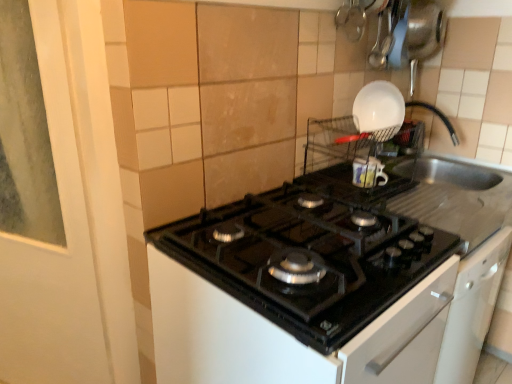
The width and height of the screenshot is (512, 384). Describe the element at coordinates (379, 110) in the screenshot. I see `white glossy bowl at upper right` at that location.

The image size is (512, 384). Identify the location of white glossy bowl at upper right. (379, 110).

Measure the distance between black glass gas stove at center and camera.

black glass gas stove at center is 28.72 inches away from camera.

Where is `black glass gas stove at center`? This screenshot has width=512, height=384. black glass gas stove at center is located at coordinates 308,257.

The height and width of the screenshot is (384, 512). What do you see at coordinates (308, 257) in the screenshot? I see `black glass gas stove at center` at bounding box center [308, 257].

This screenshot has height=384, width=512. Find the location of `white glossy bowl at upper right`. white glossy bowl at upper right is located at coordinates (379, 110).

Which object is positioned more to the left, white glossy bowl at upper right or black glass gas stove at center?

Positioned to the left is black glass gas stove at center.

Does white glossy bowl at upper right lie behind black glass gas stove at center?

Yes.

Does point (371, 108) appear closer or farther from the camera than point (320, 214)?

Clearly, point (371, 108) is more distant from the camera than point (320, 214).

Looking at this image, from the image's perspective, which object appears higher, white glossy bowl at upper right or black glass gas stove at center?

white glossy bowl at upper right appears higher in the image.

From a real-world perspective, which object rests below the other?

In real-world perspective, black glass gas stove at center is lower.

Considering the sizes of objects white glossy bowl at upper right and black glass gas stove at center in the image provided, who is thinner, white glossy bowl at upper right or black glass gas stove at center?

white glossy bowl at upper right is thinner.

Who is shorter, white glossy bowl at upper right or black glass gas stove at center?

Standing shorter between the two is black glass gas stove at center.

Considering the relative sizes of white glossy bowl at upper right and black glass gas stove at center in the image provided, is white glossy bowl at upper right bigger than black glass gas stove at center?

No.

Is black glass gas stove at center a part of white glossy bowl at upper right?

No, black glass gas stove at center is not a part of white glossy bowl at upper right.

Is white glossy bowl at upper right with black glass gas stove at center?

No, white glossy bowl at upper right is not touching black glass gas stove at center.

Is white glossy bowl at upper right turned away from black glass gas stove at center?

No, white glossy bowl at upper right is not facing the opposite direction of black glass gas stove at center.

How many degrees apart are the facing directions of white glossy bowl at upper right and black glass gas stove at center?

0.0331 degrees separate the facing orientations of white glossy bowl at upper right and black glass gas stove at center.

Locate an element on the screen. Image resolution: width=512 pixels, height=384 pixels. gas stove lying in front of the white glossy bowl at upper right is located at coordinates (308, 257).

Is black glass gas stove at center at the left side of white glossy bowl at upper right?

Correct, you'll find black glass gas stove at center to the left of white glossy bowl at upper right.

Which object is further away from the camera taking this photo, black glass gas stove at center or white glossy bowl at upper right?

white glossy bowl at upper right is behind.

Does point (415, 251) appear closer or farther from the camera than point (385, 115)?

Clearly, point (415, 251) is closer to the camera than point (385, 115).

From the image's perspective, is black glass gas stove at center positioned above or below white glossy bowl at upper right?

Clearly, from the image's perspective, black glass gas stove at center is below white glossy bowl at upper right.

From a real-world perspective, is black glass gas stove at center over white glossy bowl at upper right?

No, from a real-world perspective, black glass gas stove at center is not on top of white glossy bowl at upper right.

Considering the relative sizes of black glass gas stove at center and white glossy bowl at upper right in the image provided, is black glass gas stove at center thinner than white glossy bowl at upper right?

Incorrect, the width of black glass gas stove at center is not less than that of white glossy bowl at upper right.

Considering the sizes of objects black glass gas stove at center and white glossy bowl at upper right in the image provided, who is shorter, black glass gas stove at center or white glossy bowl at upper right?

black glass gas stove at center.

Who is bigger, black glass gas stove at center or white glossy bowl at upper right?

black glass gas stove at center is bigger.

Is black glass gas stove at center situated inside white glossy bowl at upper right or outside?

The correct answer is: outside.

Is black glass gas stove at center touching white glossy bowl at upper right?

They are not placed beside each other.

Is black glass gas stove at center facing towards white glossy bowl at upper right?

No.

What's the angular difference between black glass gas stove at center and white glossy bowl at upper right's facing directions?

0.0331 degrees separate the facing orientations of black glass gas stove at center and white glossy bowl at upper right.

At what (x,y) coordinates should I click in order to perform the action: click on gas stove lying below the white glossy bowl at upper right (from the image's perspective). Please return your answer as a coordinate pair (x, y). Looking at the image, I should click on (308, 257).

Identify the location of gas stove below the white glossy bowl at upper right (from the image's perspective). This screenshot has height=384, width=512. (308, 257).

The width and height of the screenshot is (512, 384). Identify the location of gas stove located in front of the white glossy bowl at upper right. click(308, 257).